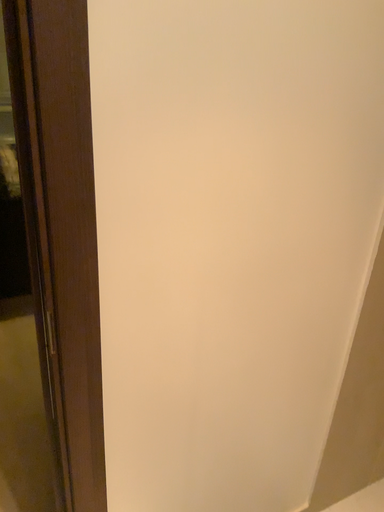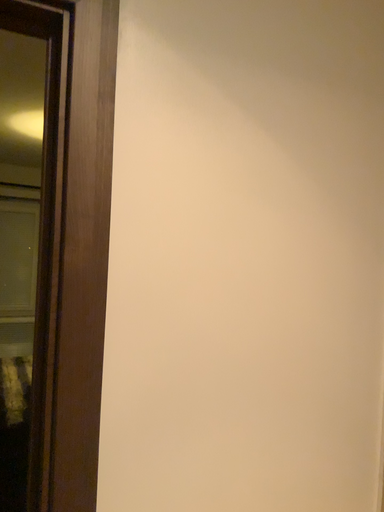
Question: How did the camera likely rotate when shooting the video?

Choices:
 (A) rotated downward
 (B) rotated upward

Answer: (B)